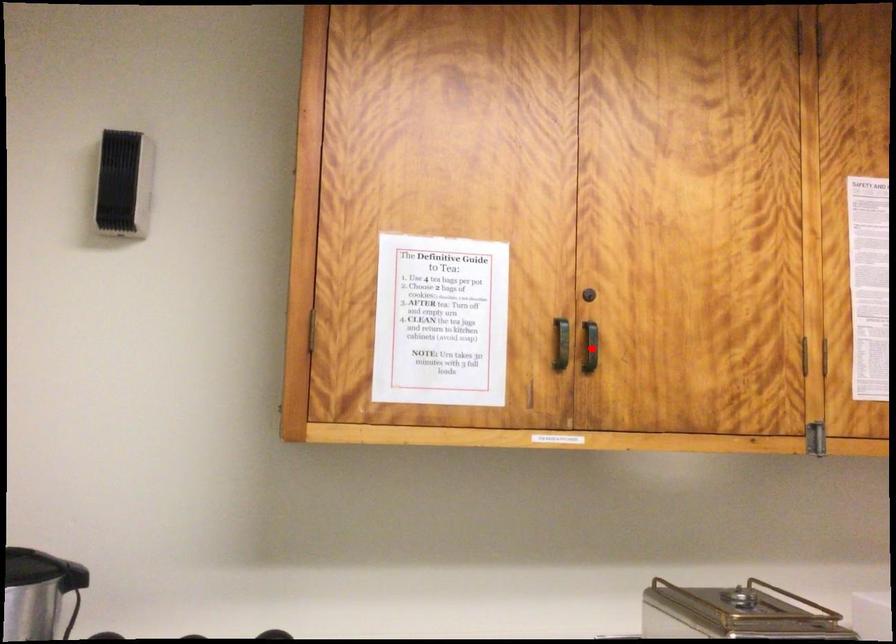
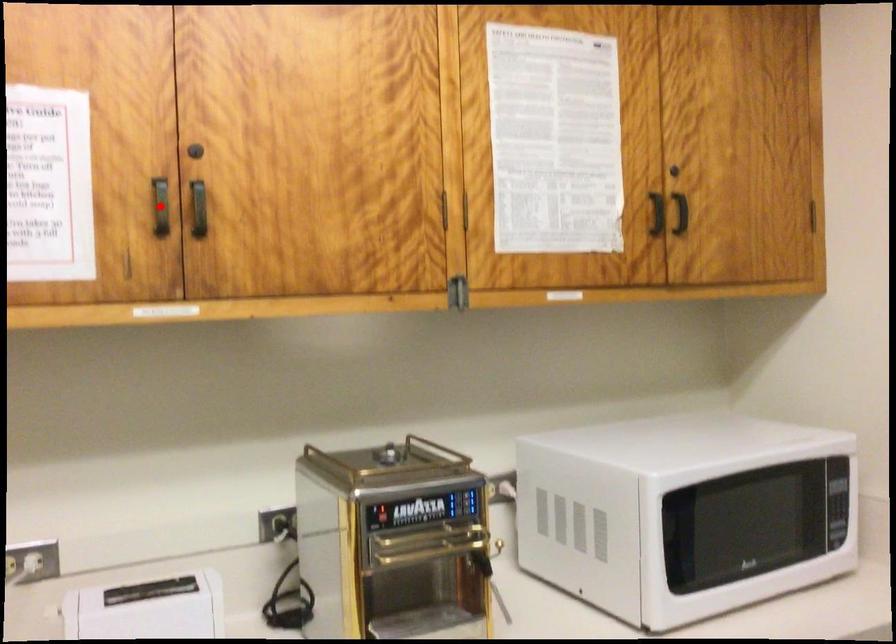
I am providing you with two images of the same scene from different viewpoints. A red point is marked on the first image and another point is marked on the second image. Is the red point in image1 aligned with the point shown in image2?

No